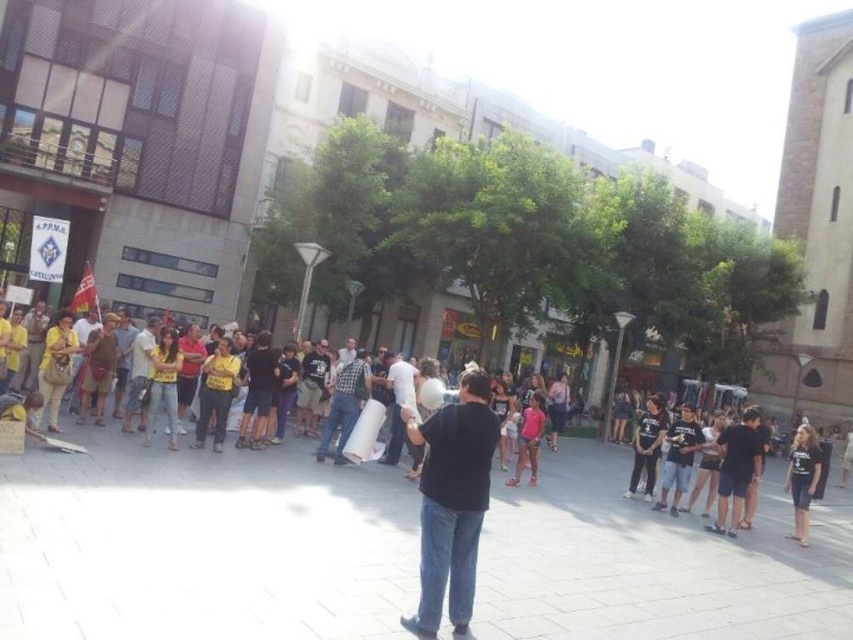
Question: Which object is the closest to the black cotton t-shirt at lower right?

Choices:
 (A) black matte shirt at center
 (B) checkered fabric shirt at center
 (C) white cotton shirt at center

Answer: (C)

Question: Does yellow/yellowish fabric at left have a larger size compared to white cotton shirt at center?

Choices:
 (A) no
 (B) yes

Answer: (B)

Question: Considering the relative positions of yellow/yellowish fabric at left and checkered fabric shirt at center in the image provided, where is yellow/yellowish fabric at left located with respect to checkered fabric shirt at center?

Choices:
 (A) left
 (B) right

Answer: (B)

Question: Which object is the closest to the checkered fabric shirt at center?

Choices:
 (A) yellow/yellowish fabric at left
 (B) black matte shirt at center
 (C) black cotton t-shirt at lower right

Answer: (A)

Question: Which object is the closest to the yellow/yellowish fabric at left?

Choices:
 (A) gray concrete pavement at center
 (B) black matte shirt at center

Answer: (A)

Question: Is yellow/yellowish fabric at left bigger than black matte shirt at center?

Choices:
 (A) no
 (B) yes

Answer: (B)